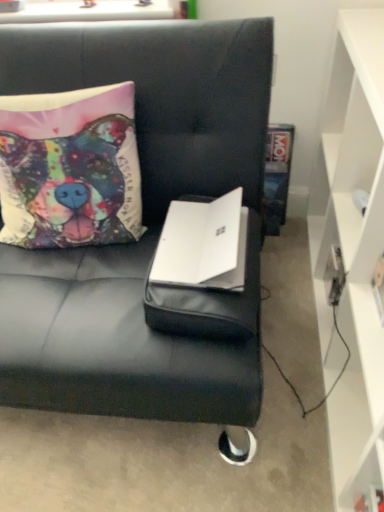
Question: Are multicolored fabric pillow at upper left and white matte laptop at center making contact?

Choices:
 (A) yes
 (B) no

Answer: (B)

Question: Does multicolored fabric pillow at upper left have a greater width compared to white matte laptop at center?

Choices:
 (A) yes
 (B) no

Answer: (B)

Question: Does multicolored fabric pillow at upper left have a lesser width compared to white matte laptop at center?

Choices:
 (A) no
 (B) yes

Answer: (B)

Question: Does multicolored fabric pillow at upper left have a greater height compared to white matte laptop at center?

Choices:
 (A) no
 (B) yes

Answer: (B)

Question: Is multicolored fabric pillow at upper left closer to the viewer compared to white matte laptop at center?

Choices:
 (A) yes
 (B) no

Answer: (B)

Question: From their relative heights in the image, would you say white matte cabinet at right is taller or shorter than black leather couch at center?

Choices:
 (A) tall
 (B) short

Answer: (B)

Question: In the image, is white matte cabinet at right positioned in front of or behind black leather couch at center?

Choices:
 (A) front
 (B) behind

Answer: (A)

Question: From the image's perspective, is white matte cabinet at right positioned above or below black leather couch at center?

Choices:
 (A) above
 (B) below

Answer: (B)

Question: Is point (362, 75) positioned closer to the camera than point (231, 375)?

Choices:
 (A) closer
 (B) farther

Answer: (B)

Question: In terms of height, does white matte laptop at center look taller or shorter compared to black leather couch at center?

Choices:
 (A) short
 (B) tall

Answer: (A)

Question: From the image's perspective, relative to black leather couch at center, is white matte laptop at center above or below?

Choices:
 (A) above
 (B) below

Answer: (B)

Question: In the image, is white matte laptop at center positioned in front of or behind black leather couch at center?

Choices:
 (A) front
 (B) behind

Answer: (B)

Question: In terms of size, does white matte laptop at center appear bigger or smaller than black leather couch at center?

Choices:
 (A) big
 (B) small

Answer: (B)

Question: From the image's perspective, relative to white matte laptop at center, is black leather couch at center above or below?

Choices:
 (A) below
 (B) above

Answer: (B)

Question: Is black leather couch at center to the left or to the right of white matte laptop at center in the image?

Choices:
 (A) right
 (B) left

Answer: (B)